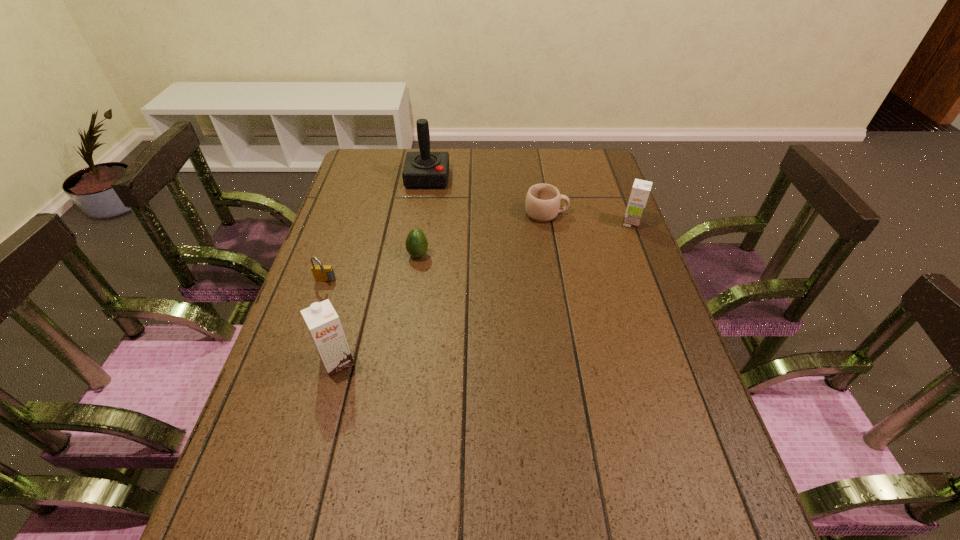
Locate an element on the screen. The width and height of the screenshot is (960, 540). free space located on the front of the right chocolate milk is located at coordinates (665, 310).

Identify the location of free point located on the base of the joystick. (419, 238).

Image resolution: width=960 pixels, height=540 pixels. What are the coordinates of `vacant space located on the side of the mug with the handle` in the screenshot? It's located at (615, 214).

The width and height of the screenshot is (960, 540). I want to click on vacant space located on the side with the combination dials of the padlock, so pos(280,411).

This screenshot has width=960, height=540. I want to click on vacant space positioned on the right of the fourth farthest object, so click(531, 255).

Identify the location of object situated at the far edge. The width and height of the screenshot is (960, 540). (424, 169).

The height and width of the screenshot is (540, 960). In order to click on chocolate milk that is at the left edge in this screenshot , I will do `click(323, 323)`.

In order to click on padlock positioned at the left edge in this screenshot , I will do `click(324, 273)`.

Locate an element on the screen. The height and width of the screenshot is (540, 960). object situated at the right edge is located at coordinates (639, 195).

Where is `vacant area at the far edge`? vacant area at the far edge is located at coordinates (531, 157).